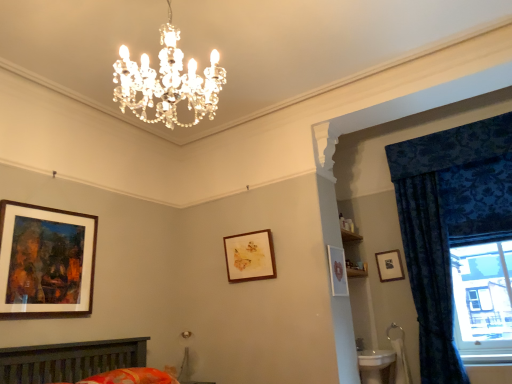
Question: Does wooden-framed painting at left, which ranks as the first picture frame in left-to-right order, have a smaller size compared to floral cotton bedspread at lower center?

Choices:
 (A) no
 (B) yes

Answer: (A)

Question: Does wooden-framed painting at left, which ranks as the fourth picture frame in right-to-left order, touch floral cotton bedspread at lower center?

Choices:
 (A) yes
 (B) no

Answer: (B)

Question: From a real-world perspective, is wooden-framed painting at left, which is the 4th picture frame from back to front, below floral cotton bedspread at lower center?

Choices:
 (A) yes
 (B) no

Answer: (B)

Question: Does wooden-framed painting at left, which ranks as the first picture frame in left-to-right order, have a lesser height compared to floral cotton bedspread at lower center?

Choices:
 (A) yes
 (B) no

Answer: (B)

Question: Is floral cotton bedspread at lower center located within wooden-framed painting at left, which ranks as the first picture frame in left-to-right order?

Choices:
 (A) no
 (B) yes

Answer: (A)

Question: Considering the positions of velvet blue curtain at right, which is counted as the 1th curtain, starting from the left, and matte white picture frame at center-right, which appears as the second picture frame when viewed from the right, in the image, is velvet blue curtain at right, which is counted as the 1th curtain, starting from the left, wider or thinner than matte white picture frame at center-right, which appears as the second picture frame when viewed from the right,?

Choices:
 (A) wide
 (B) thin

Answer: (A)

Question: Considering the positions of velvet blue curtain at right, acting as the 2th curtain starting from the right, and matte white picture frame at center-right, positioned as the 2th picture frame in front-to-back order, in the image, is velvet blue curtain at right, acting as the 2th curtain starting from the right, taller or shorter than matte white picture frame at center-right, positioned as the 2th picture frame in front-to-back order,?

Choices:
 (A) short
 (B) tall

Answer: (B)

Question: From a real-world perspective, is velvet blue curtain at right, which is counted as the 1th curtain, starting from the left, positioned above or below matte white picture frame at center-right, the third picture frame positioned from the left?

Choices:
 (A) below
 (B) above

Answer: (A)

Question: Based on their positions, is velvet blue curtain at right, which is counted as the 1th curtain, starting from the left, located to the left or right of matte white picture frame at center-right, the third picture frame positioned from the left?

Choices:
 (A) right
 (B) left

Answer: (A)

Question: Does point click(455, 188) appear closer or farther from the camera than point click(4, 220)?

Choices:
 (A) farther
 (B) closer

Answer: (A)

Question: Is blue velvet curtain at right, the first curtain when ordered from right to left, spatially inside wooden-framed painting at left, which ranks as the fourth picture frame in right-to-left order, or outside of it?

Choices:
 (A) outside
 (B) inside

Answer: (A)

Question: Looking at their shapes, would you say blue velvet curtain at right, the first curtain when ordered from right to left, is wider or thinner than wooden-framed painting at left, which is the 4th picture frame from back to front?

Choices:
 (A) thin
 (B) wide

Answer: (A)

Question: From the image's perspective, is blue velvet curtain at right, the 2th curtain from the left, located above or below wooden-framed painting at left, which is the 4th picture frame from back to front?

Choices:
 (A) below
 (B) above

Answer: (A)

Question: Looking at the image, does matte black picture frame at upper right, which is the 1th picture frame from back to front, seem bigger or smaller compared to matte white picture frame at center-right, the third picture frame positioned from the left?

Choices:
 (A) small
 (B) big

Answer: (A)

Question: Is matte black picture frame at upper right, which is the 1th picture frame from back to front, in front of or behind matte white picture frame at center-right, the third picture frame positioned from the left, in the image?

Choices:
 (A) front
 (B) behind

Answer: (B)